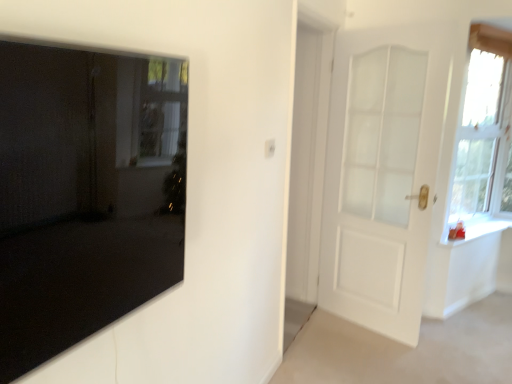
Question: Is matte black mirror at left, which is counted as the 2th door, starting from the back, thinner than white glossy window sill at right?

Choices:
 (A) no
 (B) yes

Answer: (B)

Question: Is matte black mirror at left, which is the first door in left-to-right order, turned away from white glossy window sill at right?

Choices:
 (A) no
 (B) yes

Answer: (A)

Question: Is white glossy window sill at right completely or partially inside matte black mirror at left, which ranks as the 2th door in right-to-left order?

Choices:
 (A) yes
 (B) no

Answer: (B)

Question: Does matte black mirror at left, placed as the 1th door when sorted from front to back, have a greater width compared to white glossy window sill at right?

Choices:
 (A) no
 (B) yes

Answer: (A)

Question: Is matte black mirror at left, which is the first door in left-to-right order, bigger than white glossy window sill at right?

Choices:
 (A) no
 (B) yes

Answer: (B)

Question: Choose the correct answer: Is white glossy window sill at right inside white matte door at right, which is the first door from right to left, or outside it?

Choices:
 (A) outside
 (B) inside

Answer: (A)

Question: In terms of height, does white glossy window sill at right look taller or shorter compared to white matte door at right, which is the first door from right to left?

Choices:
 (A) tall
 (B) short

Answer: (B)

Question: Considering the relative positions of white glossy window sill at right and white matte door at right, which is the second door in front-to-back order, in the image provided, is white glossy window sill at right to the left or to the right of white matte door at right, which is the second door in front-to-back order,?

Choices:
 (A) right
 (B) left

Answer: (A)

Question: Considering the positions of white glossy window sill at right and white matte door at right, the 2th door positioned from the left, in the image, is white glossy window sill at right wider or thinner than white matte door at right, the 2th door positioned from the left,?

Choices:
 (A) wide
 (B) thin

Answer: (A)

Question: Considering their positions, is matte black mirror at left, which ranks as the 2th door in right-to-left order, located in front of or behind white matte door at right, the 2th door positioned from the left?

Choices:
 (A) front
 (B) behind

Answer: (A)

Question: In terms of size, does matte black mirror at left, which is counted as the 2th door, starting from the back, appear bigger or smaller than white matte door at right, which is the second door in front-to-back order?

Choices:
 (A) big
 (B) small

Answer: (B)

Question: Considering the relative positions of matte black mirror at left, placed as the 1th door when sorted from front to back, and white matte door at right, which is the first door from right to left, in the image provided, is matte black mirror at left, placed as the 1th door when sorted from front to back, to the left or to the right of white matte door at right, which is the first door from right to left,?

Choices:
 (A) right
 (B) left

Answer: (B)

Question: Is matte black mirror at left, which is the first door in left-to-right order, situated inside white matte door at right, the first door in the back-to-front sequence, or outside?

Choices:
 (A) inside
 (B) outside

Answer: (B)

Question: From a real-world perspective, is white frosted glass window at upper right physically located above or below matte black mirror at left, placed as the 1th door when sorted from front to back?

Choices:
 (A) above
 (B) below

Answer: (B)

Question: Is white frosted glass window at upper right inside or outside of matte black mirror at left, which is counted as the 2th door, starting from the back?

Choices:
 (A) outside
 (B) inside

Answer: (A)